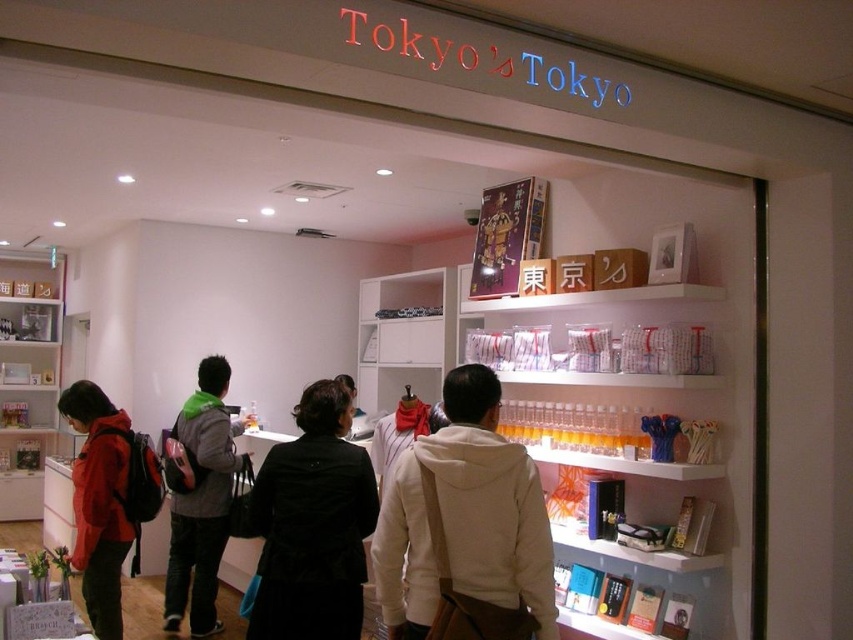
Question: Is white fleece jacket at center wider than black velvet coat at center?

Choices:
 (A) no
 (B) yes

Answer: (B)

Question: Is white fleece jacket at center wider than black velvet coat at center?

Choices:
 (A) yes
 (B) no

Answer: (A)

Question: Which point appears closest to the camera in this image?

Choices:
 (A) (463, 438)
 (B) (100, 620)
 (C) (370, 497)
 (D) (202, 550)

Answer: (A)

Question: Estimate the real-world distances between objects in this image. Which object is closer to the gray backpack at center?

Choices:
 (A) white fleece jacket at center
 (B) matte red jacket at left

Answer: (B)

Question: Is black velvet coat at center positioned in front of gray backpack at center?

Choices:
 (A) yes
 (B) no

Answer: (A)

Question: Which point is farther to the camera?

Choices:
 (A) (474, 388)
 (B) (210, 548)

Answer: (B)